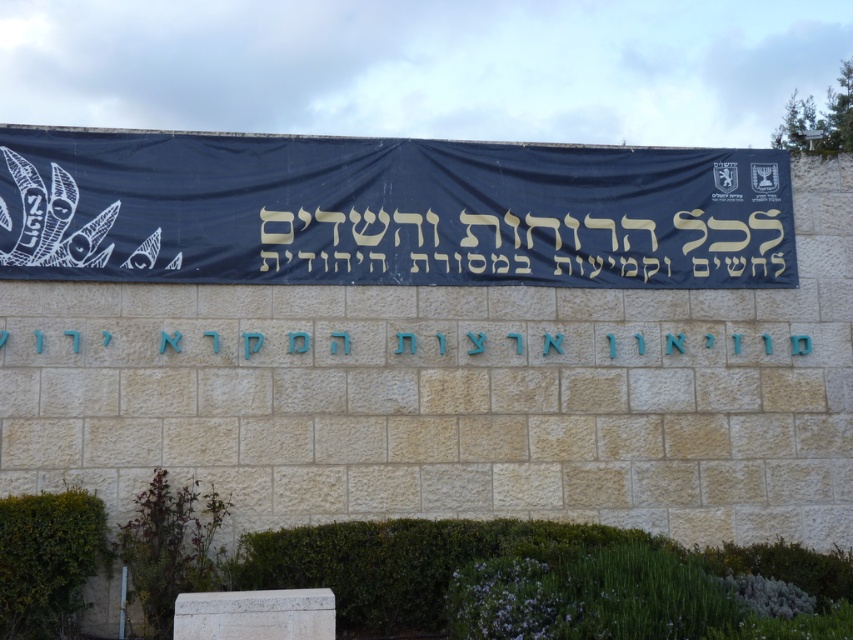
Which is above, black fabric banner at center or blue stone sign at center?

black fabric banner at center is higher up.

Can you confirm if black fabric banner at center is shorter than blue stone sign at center?

No, black fabric banner at center is not shorter than blue stone sign at center.

Does point (592, 234) come in front of point (793, 337)?

Yes, point (592, 234) is closer to viewer.

Identify the location of black fabric banner at center. (387, 211).